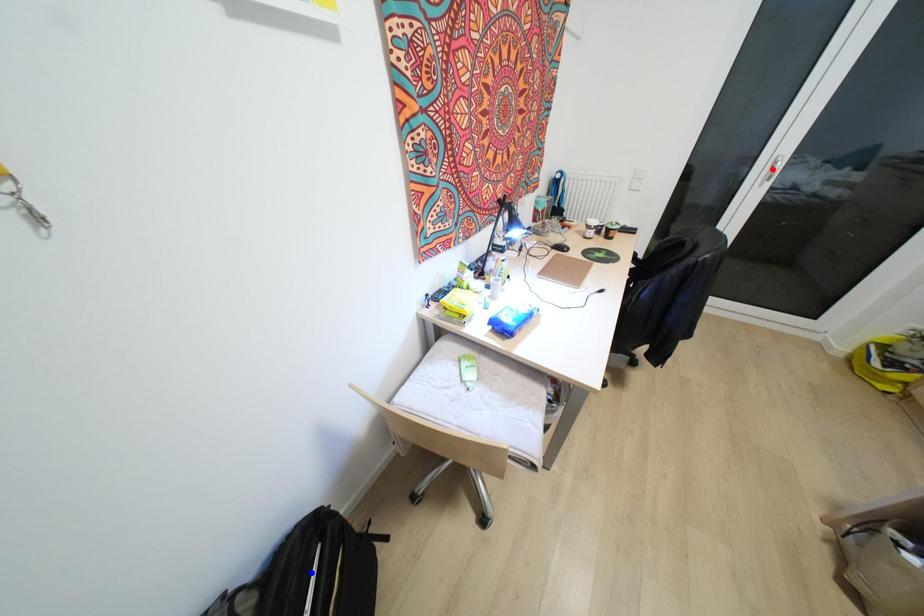
Question: Which of the two points in the image is closer to the camera?

Choices:
 (A) Blue point is closer.
 (B) Red point is closer.

Answer: (A)